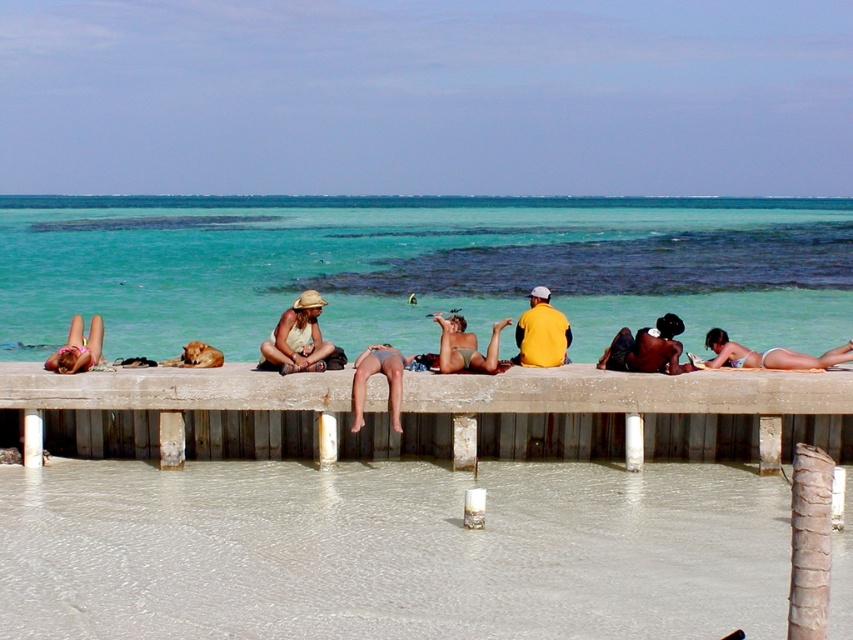
You are standing on the wooden pier and see two points marked on the water surface below. The first point is labeled as point (460,369) and the second is point (51,362). From your perspective on the pier, which point is closer to you?

Point (460,369) is in front of point (51,362), so it is closer to you.

You are standing on the wooden pier and want to pick up both the matte beige hat at center and the matte white bikini at lower right. Which item should you reach for first to grab the one closer to you?

The matte beige hat at center is closer to the viewer than the matte white bikini at lower right, so you should reach for the matte beige hat at center first.